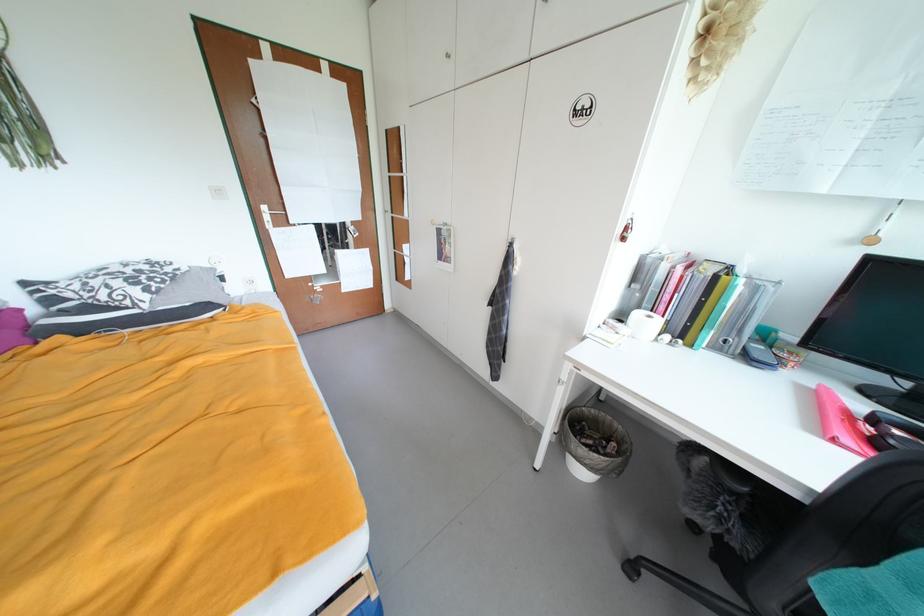
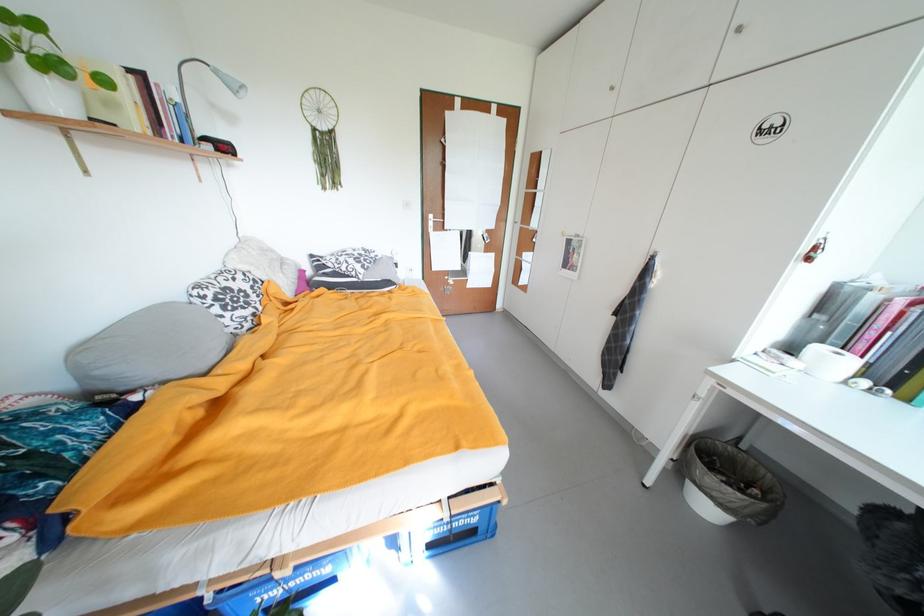
Question: How did the camera likely rotate?

Choices:
 (A) Left
 (B) Right
 (C) Up
 (D) Down

Answer: (A)